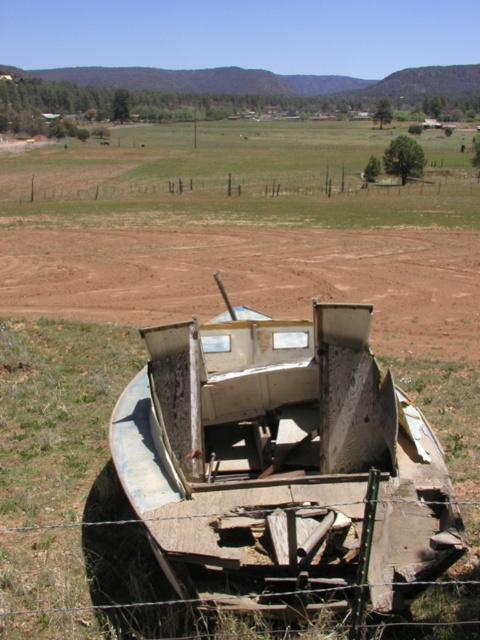
Describe the element at coordinates (252, 276) in the screenshot. This screenshot has height=640, width=480. I see `brown dirt field at center` at that location.

Describe the element at coordinates (252, 276) in the screenshot. This screenshot has height=640, width=480. I see `brown dirt field at center` at that location.

Where is `brown dirt field at center`? This screenshot has height=640, width=480. brown dirt field at center is located at coordinates (252, 276).

Which is below, rusty metal boat at center or brown wooden fence at upper center?

rusty metal boat at center is below.

Who is more forward, (x=360, y=465) or (x=240, y=192)?

Point (x=360, y=465) is in front.

Where is `rusty metal boat at center`? The image size is (480, 640). rusty metal boat at center is located at coordinates (283, 465).

Who is more distant from viewer, (x=265, y=600) or (x=187, y=300)?

Point (x=187, y=300)

This screenshot has width=480, height=640. I want to click on rusty metal boat at center, so click(283, 465).

At what (x,y) coordinates should I click in order to perform the action: click on rusty metal boat at center. Please return your answer as a coordinate pair (x, y). Looking at the image, I should click on (283, 465).